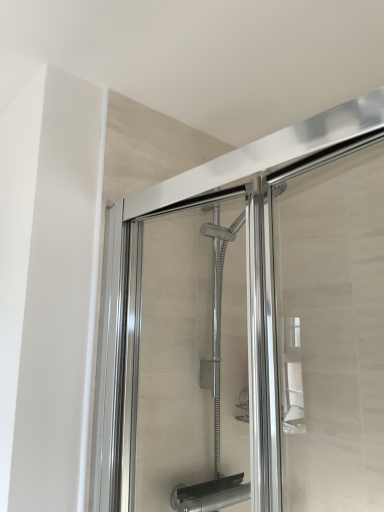
The height and width of the screenshot is (512, 384). Find the location of `clear glass shower door at upper center`. clear glass shower door at upper center is located at coordinates (203, 358).

What do you see at coordinates (203, 358) in the screenshot? I see `clear glass shower door at upper center` at bounding box center [203, 358].

The width and height of the screenshot is (384, 512). What are the coordinates of `clear glass shower door at upper center` in the screenshot? It's located at (203, 358).